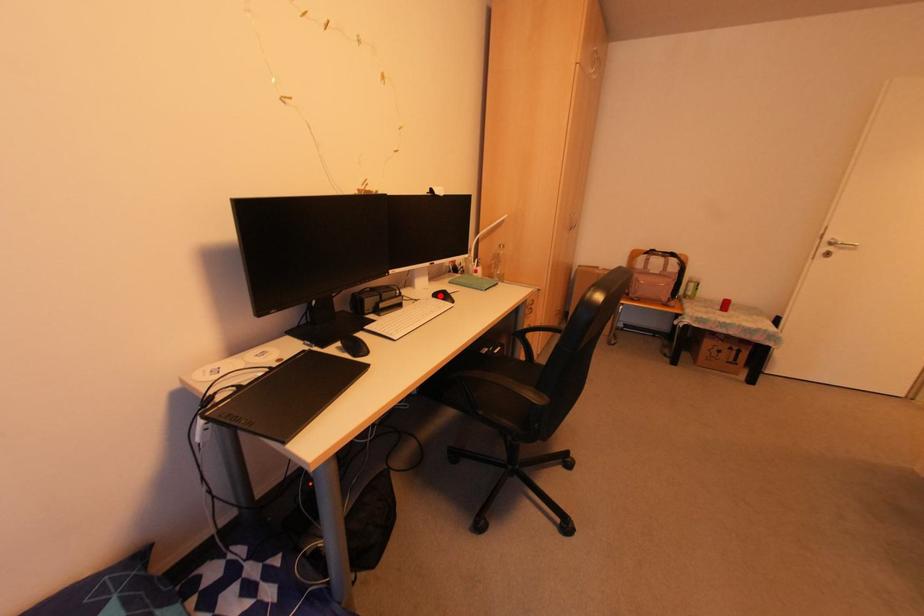
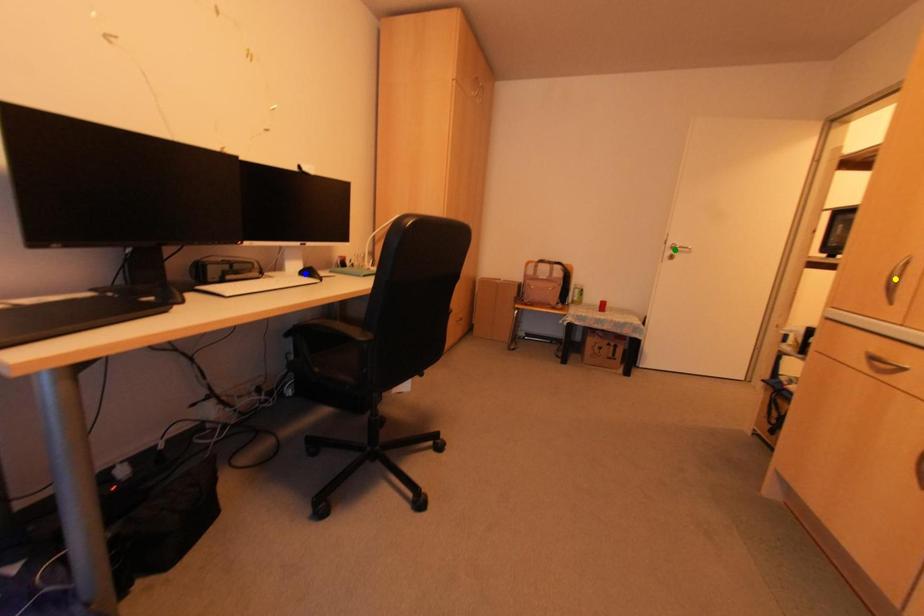
Question: I am providing you with two images of the same scene from different viewpoints. A red point is marked on the first image. You are given multiple points on the second image. In image 2, which mark is for the same physical point as the one in image 1?

Choices:
 (A) green point
 (B) blue point
 (C) yellow point

Answer: (B)